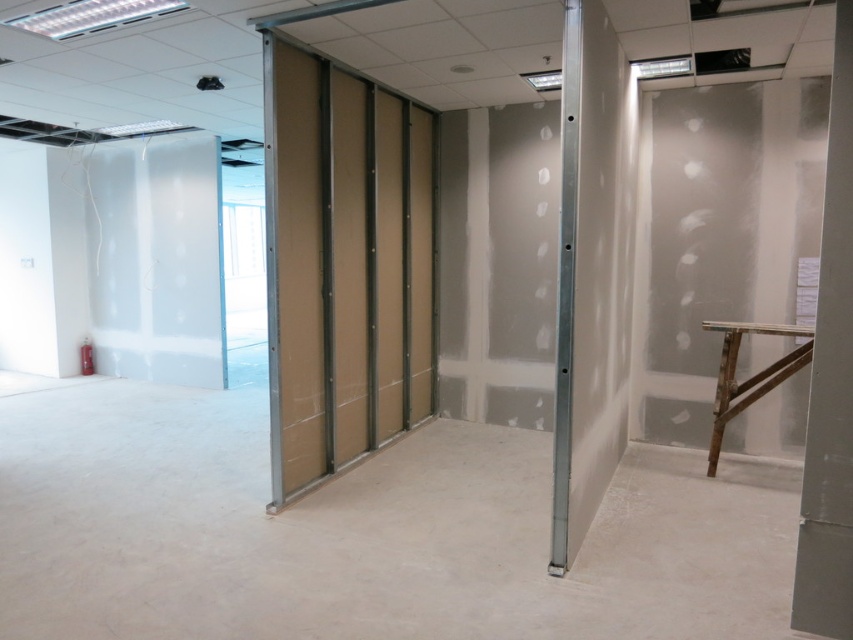
Consider the image. You are a construction worker standing in the room and need to move a 3.5 meter long metal beam through the doorway. The beam is too long to carry horizontally. Can you safely move it vertically through the doorway without hitting the metallic silver pillar at center?

The metallic silver pillar at center is 2.84 meters away from the viewer. Since the beam is 3.5 meters long, which is longer than the distance to the pillar, moving it vertically would risk collision. Therefore, it cannot be safely moved vertically without hitting the pillar.

You are standing in the construction area and need to reach the white smooth pillar at right. Which direction should you move relative to the metallic silver pillar at center?

You should move behind the metallic silver pillar at center to reach the white smooth pillar at right, since the white smooth pillar at right is located behind it.

You are a construction worker needing to place a 1.5 meter long beam between the metallic silver pillar at center and the white smooth pillar at right. Can the beam fit between them?

The metallic silver pillar at center is 1.21 meters away from the white smooth pillar at right. Since the beam is 1.5 meters long, it cannot fit between them as the distance is shorter than the beam.